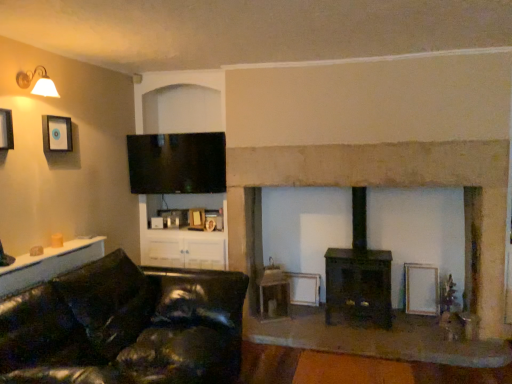
Question: Considering the relative sizes of white glossy cabinet at lower left and matte black picture frame at upper left, arranged as the second picture frame when viewed from the top, in the image provided, is white glossy cabinet at lower left wider than matte black picture frame at upper left, arranged as the second picture frame when viewed from the top,?

Choices:
 (A) no
 (B) yes

Answer: (B)

Question: Is matte black picture frame at upper left, the 3th picture frame in the right-to-left sequence, completely or partially inside white glossy cabinet at lower left?

Choices:
 (A) yes
 (B) no

Answer: (B)

Question: From a real-world perspective, does white glossy cabinet at lower left sit lower than matte black picture frame at upper left, the 1th picture frame viewed from the front?

Choices:
 (A) yes
 (B) no

Answer: (A)

Question: Can you confirm if white glossy cabinet at lower left is bigger than matte black picture frame at upper left, acting as the second picture frame starting from the bottom?

Choices:
 (A) no
 (B) yes

Answer: (B)

Question: Does white glossy cabinet at lower left appear on the left side of matte black picture frame at upper left, the 3th picture frame in the right-to-left sequence?

Choices:
 (A) yes
 (B) no

Answer: (B)

Question: Does white glossy cabinet at lower left have a lesser width compared to matte black picture frame at upper left, the 1th picture frame viewed from the front?

Choices:
 (A) yes
 (B) no

Answer: (B)

Question: Considering the relative sizes of white glossy cabinet at lower left and matte black picture frame at upper left, the second picture frame from the right, in the image provided, is white glossy cabinet at lower left shorter than matte black picture frame at upper left, the second picture frame from the right,?

Choices:
 (A) yes
 (B) no

Answer: (A)

Question: From a real-world perspective, is white glossy cabinet at lower left over matte black picture frame at upper left, arranged as the 3th picture frame when ordered from the bottom?

Choices:
 (A) no
 (B) yes

Answer: (A)

Question: From the image's perspective, does white glossy cabinet at lower left appear higher than matte black picture frame at upper left, acting as the second picture frame starting from the front?

Choices:
 (A) yes
 (B) no

Answer: (B)

Question: Is white glossy cabinet at lower left closer to the viewer compared to matte black picture frame at upper left, acting as the second picture frame starting from the front?

Choices:
 (A) yes
 (B) no

Answer: (A)

Question: Is matte black picture frame at upper left, the second picture frame viewed from the left, a part of white glossy cabinet at lower left?

Choices:
 (A) no
 (B) yes

Answer: (A)

Question: Is white glossy cabinet at lower left positioned far away from matte black picture frame at upper left, the second picture frame viewed from the left?

Choices:
 (A) yes
 (B) no

Answer: (B)

Question: Can you confirm if dark brown wood burning stove at center is taller than white matte picture frame at lower right, the first picture frame positioned from the right?

Choices:
 (A) yes
 (B) no

Answer: (A)